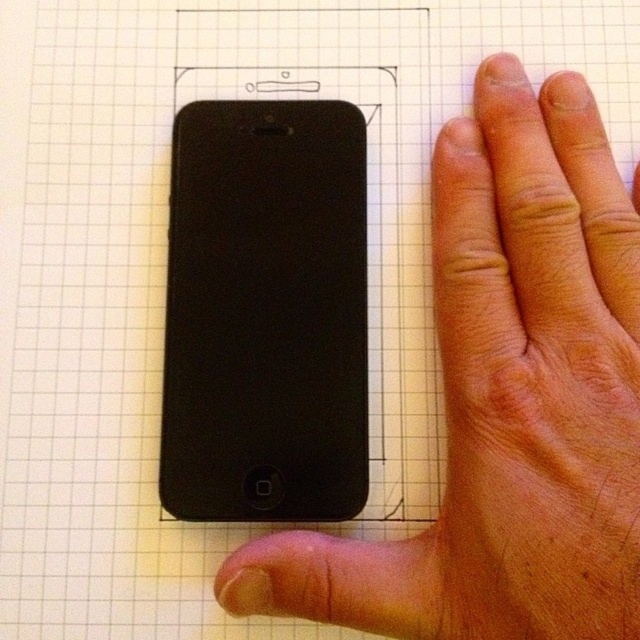
Question: Observing the image, what is the correct spatial positioning of matte black phone at left in reference to matte black smartphone at center?

Choices:
 (A) above
 (B) below

Answer: (B)

Question: Which of the following is the closest to the observer?

Choices:
 (A) matte black smartphone at center
 (B) matte black phone at left

Answer: (B)

Question: Does matte black phone at left appear under matte black smartphone at center?

Choices:
 (A) yes
 (B) no

Answer: (A)

Question: Which point is farther from the camera taking this photo?

Choices:
 (A) (248, 170)
 (B) (588, 131)

Answer: (A)

Question: From the image, what is the correct spatial relationship of matte black phone at left in relation to matte black smartphone at center?

Choices:
 (A) right
 (B) left

Answer: (A)

Question: Which point is farther to the camera?

Choices:
 (A) matte black smartphone at center
 (B) matte black phone at left

Answer: (A)